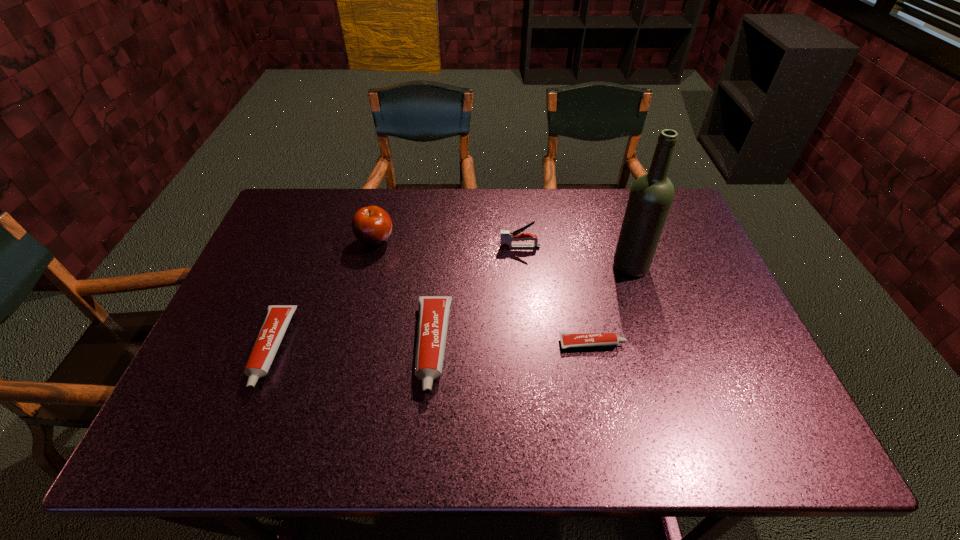
The image size is (960, 540). Identify the location of vacant space that's between the second object from left to right and the rightmost object. (503, 254).

Find the location of a particular element. This screenshot has width=960, height=540. free space between the shortest object and the fourth object from right to left is located at coordinates (512, 346).

Locate an element on the screen. The height and width of the screenshot is (540, 960). free space between the second tallest toothpaste and the second toothpaste from right to left is located at coordinates point(351,348).

This screenshot has height=540, width=960. Find the location of `vacant region between the leftmost object and the third tallest object`. vacant region between the leftmost object and the third tallest object is located at coordinates (396, 298).

Locate an element on the screen. This screenshot has width=960, height=540. object that stands as the third closest to the shortest toothpaste is located at coordinates tap(507, 237).

This screenshot has width=960, height=540. I want to click on object that is the second closest to the third object from right to left, so click(433, 316).

Image resolution: width=960 pixels, height=540 pixels. I want to click on toothpaste that is the second closest one to the fourth object from left to right, so click(x=568, y=340).

Locate which toothpaste ranks in proximity to the stapler. Please provide its 2D coordinates. Your answer should be formatted as a tuple, i.e. [(x, y)], where the tuple contains the x and y coordinates of a point satisfying the conditions above.

[(433, 316)]

The height and width of the screenshot is (540, 960). I want to click on free point that satisfies the following two spatial constraints: 1. on the handle side of the rightmost object; 2. on the left side of the fourth object from left to right, so click(x=521, y=266).